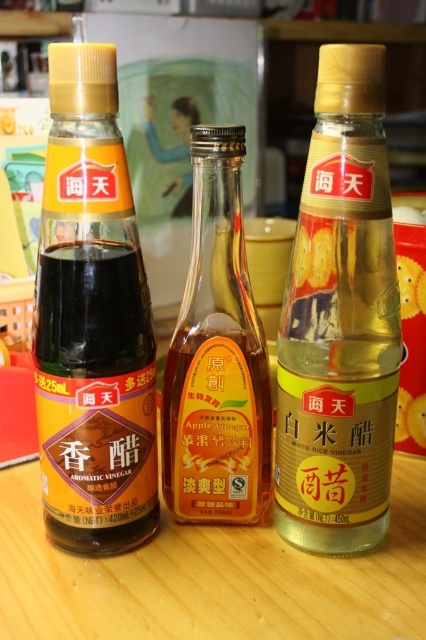
Measure the distance from yellow translucent bottle at center to matte black bottle at left.

The distance of yellow translucent bottle at center from matte black bottle at left is 5.84 inches.

Which is behind, point (382, 310) or point (83, 77)?

Positioned behind is point (382, 310).

Locate an element on the screen. This screenshot has width=426, height=640. yellow translucent bottle at center is located at coordinates (339, 321).

Does yellow translucent bottle at center have a greater width compared to translucent glass bottle at center?

Yes, yellow translucent bottle at center is wider than translucent glass bottle at center.

Is point (397, 374) behind point (265, 486)?

That is False.

The image size is (426, 640). In order to click on yellow translucent bottle at center in this screenshot , I will do `click(339, 321)`.

Consider the image. Can you confirm if matte black bottle at left is taller than translucent glass bottle at center?

Correct, matte black bottle at left is much taller as translucent glass bottle at center.

Between matte black bottle at left and translucent glass bottle at center, which one has less height?

With less height is translucent glass bottle at center.

Locate an element on the screen. matte black bottle at left is located at coordinates (94, 316).

This screenshot has width=426, height=640. I want to click on matte black bottle at left, so click(x=94, y=316).